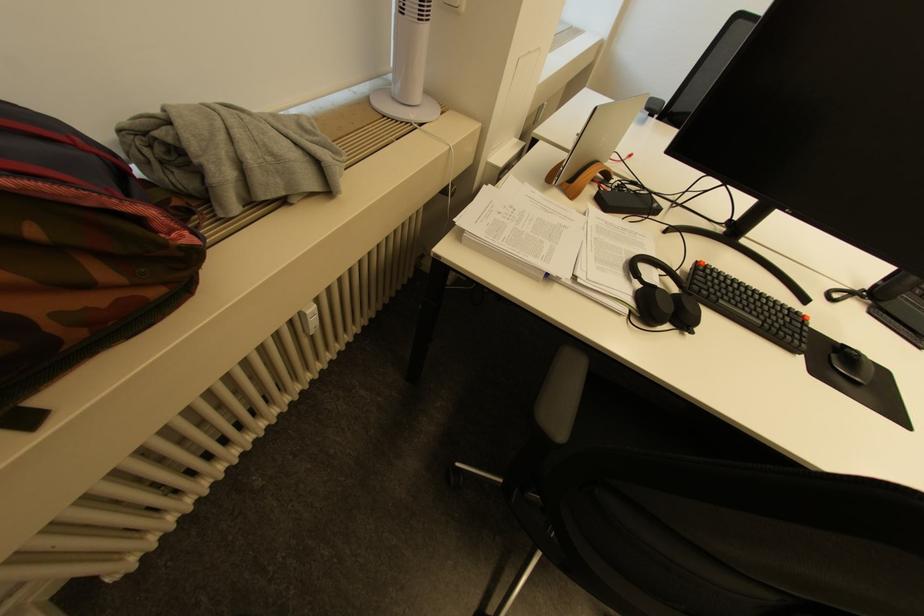
Locate an element on the screen. Image resolution: width=924 pixels, height=616 pixels. white tower fan is located at coordinates (405, 106).